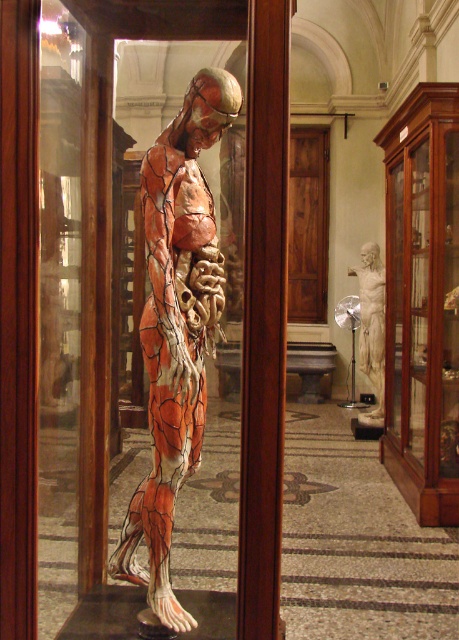
Question: Among these objects, which one is nearest to the camera?

Choices:
 (A) white marble statue at center
 (B) transparent glass at center
 (C) orange painted anatomical model at center

Answer: (C)

Question: Which is farther from the white marble statue at center?

Choices:
 (A) transparent glass at center
 (B) orange painted anatomical model at center

Answer: (A)

Question: Can you confirm if transparent glass at center is positioned to the left of orange painted anatomical model at center?

Choices:
 (A) yes
 (B) no

Answer: (A)

Question: Which point is closer to the camera?

Choices:
 (A) white marble statue at center
 (B) orange painted anatomical model at center

Answer: (B)

Question: Is orange painted anatomical model at center to the left of white marble statue at center from the viewer's perspective?

Choices:
 (A) yes
 (B) no

Answer: (A)

Question: Does transparent glass at center have a larger size compared to white marble statue at center?

Choices:
 (A) no
 (B) yes

Answer: (A)